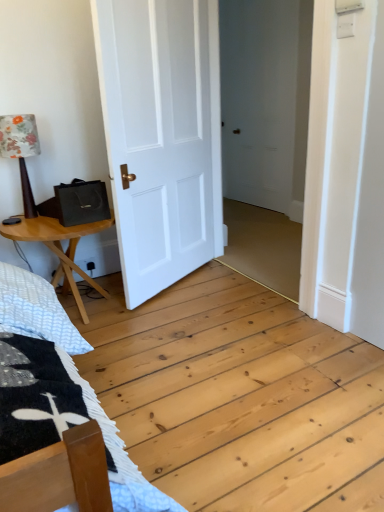
This screenshot has width=384, height=512. Identify the location of white matte door at center. (161, 136).

From the image's perspective, which object appears higher, wooden table at left or white matte door at center?

white matte door at center appears higher in the image.

Looking at their sizes, would you say wooden table at left is wider or thinner than white matte door at center?

wooden table at left is wider than white matte door at center.

This screenshot has height=512, width=384. Find the location of `table below the white matte door at center (from a real-world perspective)`. table below the white matte door at center (from a real-world perspective) is located at coordinates (60, 249).

Would you say wooden table at left is a long distance from white matte door at center?

No.

Which of these two, wooden table at left or floral fabric lampshade at left, is bigger?

With larger size is wooden table at left.

Which object is positioned more to the left, wooden table at left or floral fabric lampshade at left?

floral fabric lampshade at left is more to the left.

Is wooden table at left oriented away from floral fabric lampshade at left?

No, wooden table at left's orientation is not away from floral fabric lampshade at left.

The image size is (384, 512). In order to click on table located in front of the floral fabric lampshade at left in this screenshot , I will do `click(60, 249)`.

Is floral fabric lampshade at left outside of white matte door at center?

floral fabric lampshade at left is positioned outside white matte door at center.

Can you confirm if floral fabric lampshade at left is positioned to the left of white matte door at center?

Yes.

Can you confirm if floral fabric lampshade at left is shorter than white matte door at center?

Correct, floral fabric lampshade at left is not as tall as white matte door at center.

Where is `table lamp on the left of white matte door at center`? The height and width of the screenshot is (512, 384). table lamp on the left of white matte door at center is located at coordinates (21, 151).

Is floral fabric lampshade at left completely or partially outside of wooden table at left?

Yes, floral fabric lampshade at left is not within wooden table at left.

Can you confirm if floral fabric lampshade at left is bigger than wooden table at left?

Actually, floral fabric lampshade at left might be smaller than wooden table at left.

What's the angular difference between floral fabric lampshade at left and wooden table at left's facing directions?

There is a 1.93-degree angle between the facing directions of floral fabric lampshade at left and wooden table at left.

Is white matte door at center positioned beyond the bounds of floral fabric lampshade at left?

Indeed, white matte door at center is completely outside floral fabric lampshade at left.

Does white matte door at center come behind floral fabric lampshade at left?

No, white matte door at center is closer to the camera.

Considering the sizes of objects white matte door at center and floral fabric lampshade at left in the image provided, who is shorter, white matte door at center or floral fabric lampshade at left?

Standing shorter between the two is floral fabric lampshade at left.

I want to click on table lamp on the left of the white matte door at center, so click(x=21, y=151).

Locate an element on the screen. table on the left of white matte door at center is located at coordinates (60, 249).

Looking at their sizes, would you say white matte door at center is wider or thinner than wooden table at left?

white matte door at center is thinner than wooden table at left.

Looking at this image, is white matte door at center far away from wooden table at left?

They are positioned close to each other.

Based on the photo, from the image's perspective, is white matte door at center on top of wooden table at left?

Correct, white matte door at center appears higher than wooden table at left in the image.

In the image, there is a white matte door at center. Where is `table below it (from a real-world perspective)`? table below it (from a real-world perspective) is located at coordinates (60, 249).

This screenshot has height=512, width=384. What are the coordinates of `table lamp that appears behind the wooden table at left` in the screenshot? It's located at (21, 151).

Considering their positions, is floral fabric lampshade at left positioned closer to white matte door at center than wooden table at left?

Among the two, wooden table at left is located nearer to white matte door at center.

Based on their spatial positions, is floral fabric lampshade at left or white matte door at center closer to wooden table at left?

floral fabric lampshade at left is positioned closer to the anchor wooden table at left.

When comparing their distances from wooden table at left, does white matte door at center or floral fabric lampshade at left seem closer?

Based on the image, floral fabric lampshade at left appears to be nearer to wooden table at left.

Based on the photo, when comparing their distances from white matte door at center, does wooden table at left or floral fabric lampshade at left seem further?

Based on the image, floral fabric lampshade at left appears to be further to white matte door at center.

When comparing their distances from floral fabric lampshade at left, does wooden table at left or white matte door at center seem closer?

The object closer to floral fabric lampshade at left is wooden table at left.

Looking at the image, which one is located further to floral fabric lampshade at left, white matte door at center or wooden table at left?

white matte door at center is positioned further to the anchor floral fabric lampshade at left.

Where is `table between floral fabric lampshade at left and white matte door at center`? table between floral fabric lampshade at left and white matte door at center is located at coordinates (60, 249).